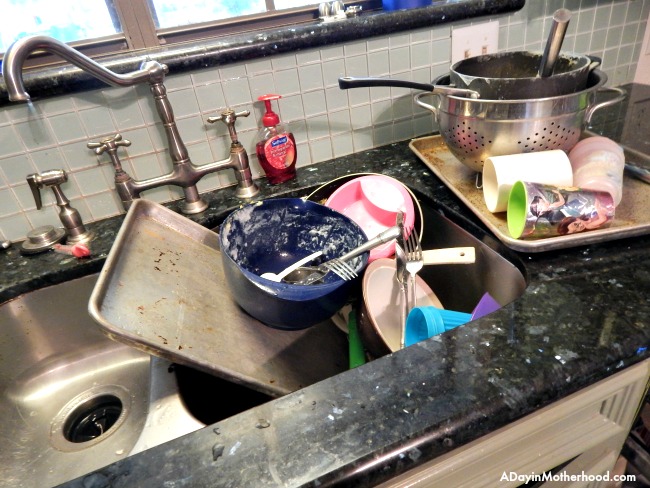
Where is `windowledge`? The width and height of the screenshot is (650, 488). windowledge is located at coordinates (223, 42), (53, 83).